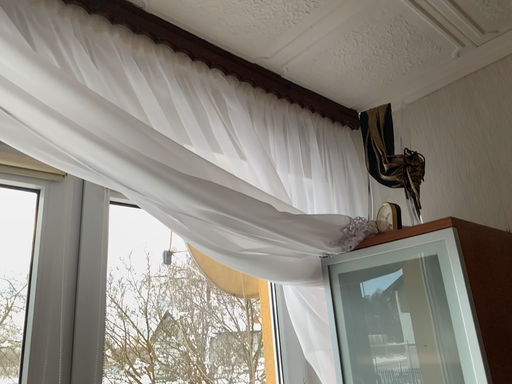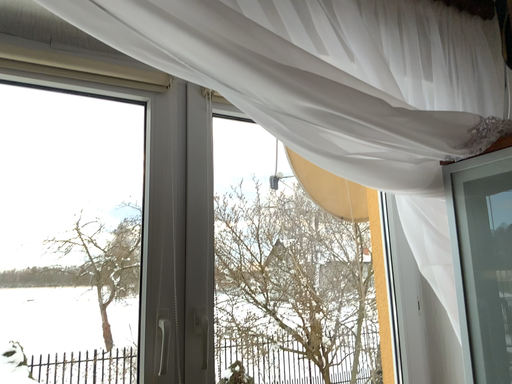
Question: How did the camera likely rotate when shooting the video?

Choices:
 (A) rotated downward
 (B) rotated upward

Answer: (A)